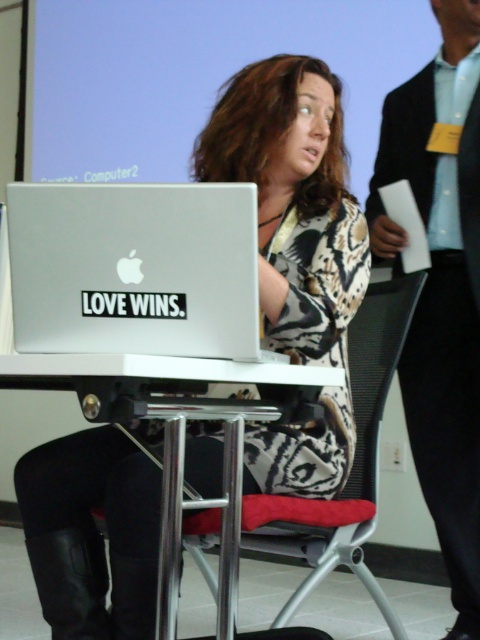
Consider the image. Can you confirm if silver metallic laptop at center is positioned below light blue shirt at upper right?

No.

Does silver metallic laptop at center have a smaller size compared to light blue shirt at upper right?

Correct, silver metallic laptop at center occupies less space than light blue shirt at upper right.

Where is `silver metallic laptop at center`? This screenshot has width=480, height=640. silver metallic laptop at center is located at coordinates (134, 268).

Who is positioned more to the right, matte silver laptop at center or silver metallic laptop at center?

matte silver laptop at center

Does matte silver laptop at center have a larger size compared to silver metallic laptop at center?

Indeed, matte silver laptop at center has a larger size compared to silver metallic laptop at center.

Find the location of a particular element. matte silver laptop at center is located at coordinates (294, 200).

Identify the location of matte silver laptop at center. (294, 200).

Does silver metallic laptop at center have a smaller size compared to black mesh chair at center?

Yes.

Can you confirm if silver metallic laptop at center is positioned below black mesh chair at center?

Actually, silver metallic laptop at center is above black mesh chair at center.

Find the location of a particular element. This screenshot has height=640, width=480. silver metallic laptop at center is located at coordinates (134, 268).

Find the location of `silver metallic laptop at center`. silver metallic laptop at center is located at coordinates (134, 268).